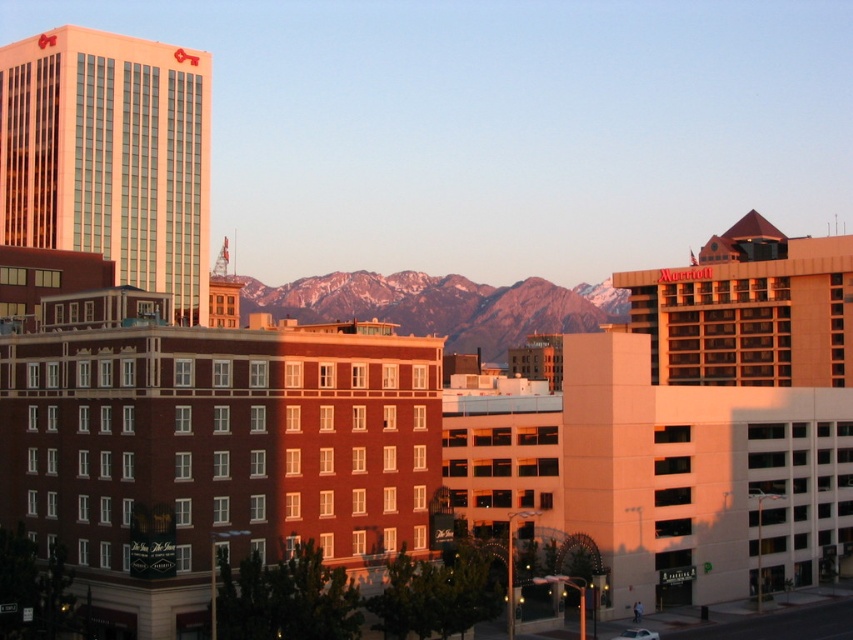
Can you confirm if brown brick building at center is positioned above snowy mountain range at center?

Incorrect, brown brick building at center is not positioned above snowy mountain range at center.

The width and height of the screenshot is (853, 640). What do you see at coordinates (210, 445) in the screenshot? I see `brown brick building at center` at bounding box center [210, 445].

Who is more forward, [126,317] or [311,276]?

Positioned in front is point [126,317].

Identify the location of brown brick building at center. The height and width of the screenshot is (640, 853). (210, 445).

Does brick building at center lie behind snowy mountain range at center?

No, it is not.

In the scene shown: Is brick building at center to the right of snowy mountain range at center from the viewer's perspective?

Indeed, brick building at center is positioned on the right side of snowy mountain range at center.

Identify the location of brick building at center. The image size is (853, 640). (428, 445).

Find the location of a particular element. brick building at center is located at coordinates (428, 445).

Looking at this image, who is taller, matte glass skyscraper at upper left or snowy mountain range at center?

Standing taller between the two is matte glass skyscraper at upper left.

Does matte glass skyscraper at upper left have a lesser height compared to snowy mountain range at center?

In fact, matte glass skyscraper at upper left may be taller than snowy mountain range at center.

Which is in front, point (207, 138) or point (584, 323)?

Point (207, 138) is in front.

You are a GUI agent. You are given a task and a screenshot of the screen. Output one action in this format:
    pyautogui.click(x=<x>, y=<y>)
    Task: Click on the matte glass skyscraper at upper left
    The width and height of the screenshot is (853, 640).
    Given the screenshot: What is the action you would take?
    pyautogui.click(x=109, y=156)